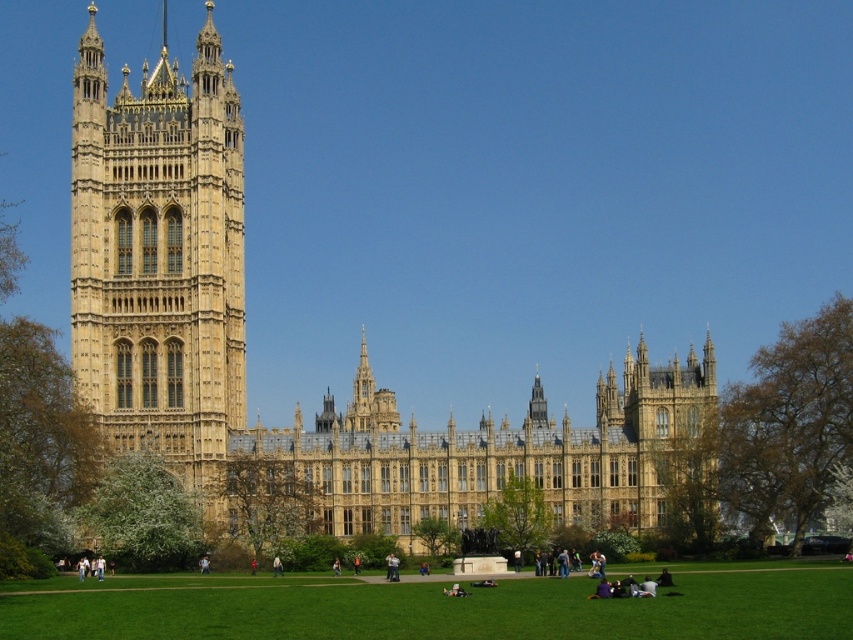
Question: Considering the relative positions of golden stone palace at left and golden stone tower at left in the image provided, where is golden stone palace at left located with respect to golden stone tower at left?

Choices:
 (A) below
 (B) above

Answer: (A)

Question: Based on their relative distances, which object is nearer to the green grass at lower center?

Choices:
 (A) golden stone palace at left
 (B) golden stone tower at left

Answer: (A)

Question: Estimate the real-world distances between objects in this image. Which object is closer to the golden stone tower at left?

Choices:
 (A) golden stone palace at left
 (B) green grass at lower center

Answer: (A)

Question: Which point appears farthest from the camera in this image?

Choices:
 (A) (228, 84)
 (B) (144, 132)

Answer: (A)

Question: Does golden stone palace at left have a greater width compared to golden stone tower at left?

Choices:
 (A) no
 (B) yes

Answer: (B)

Question: Does golden stone palace at left have a greater width compared to golden stone tower at left?

Choices:
 (A) yes
 (B) no

Answer: (A)